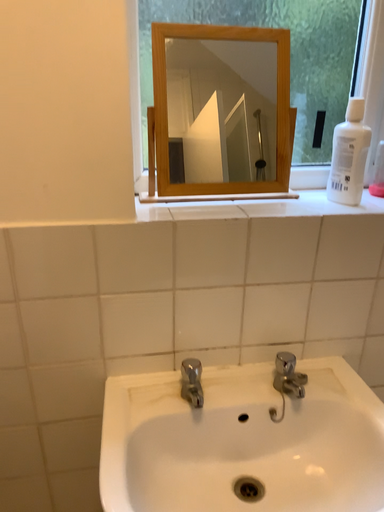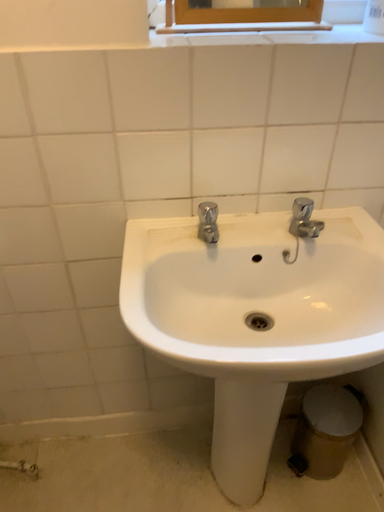
Question: Which way did the camera rotate in the video?

Choices:
 (A) rotated upward
 (B) rotated downward

Answer: (B)